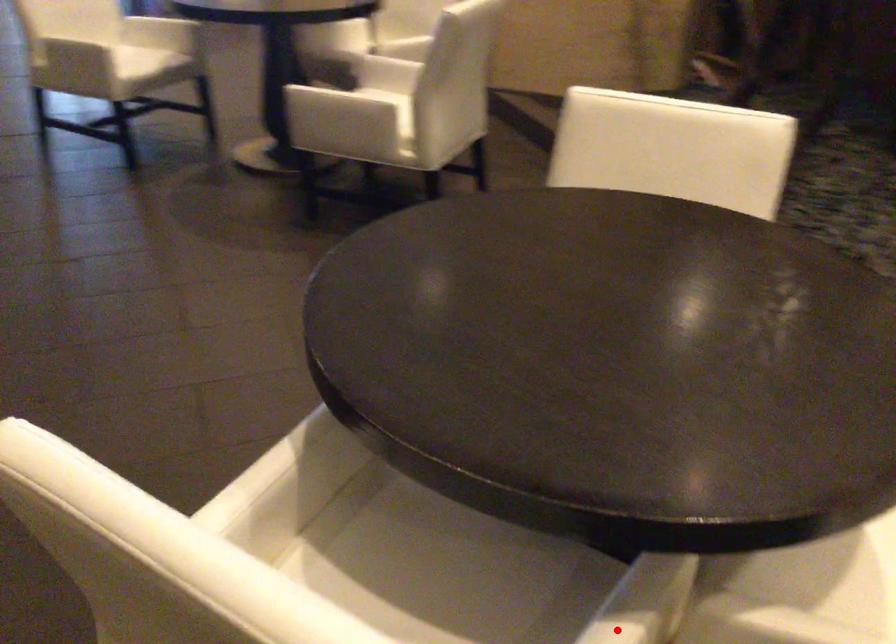
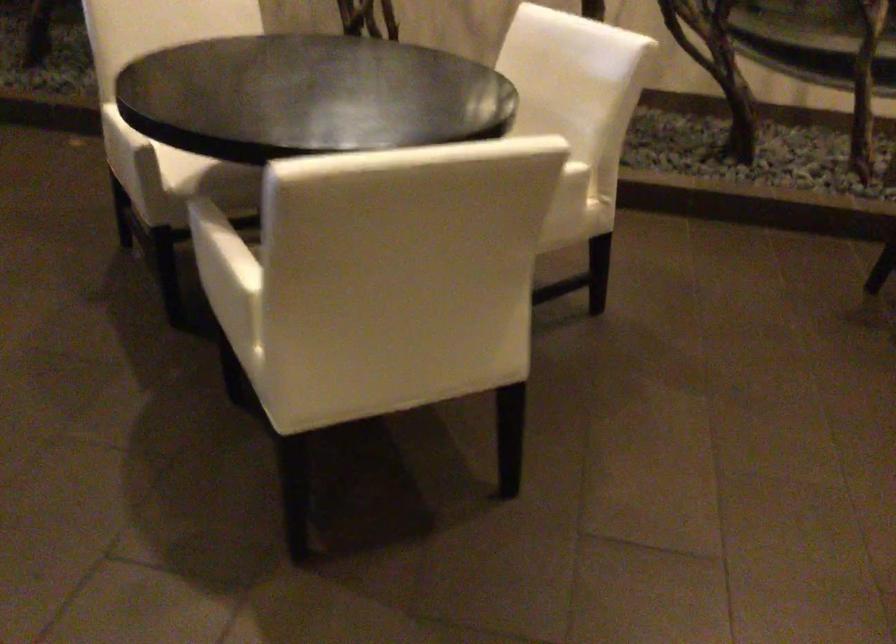
Question: I am providing you with two images of the same scene from different viewpoints. A red point is marked on the first image. Is the red point's position out of view in image 2?

Choices:
 (A) Yes
 (B) No

Answer: (A)